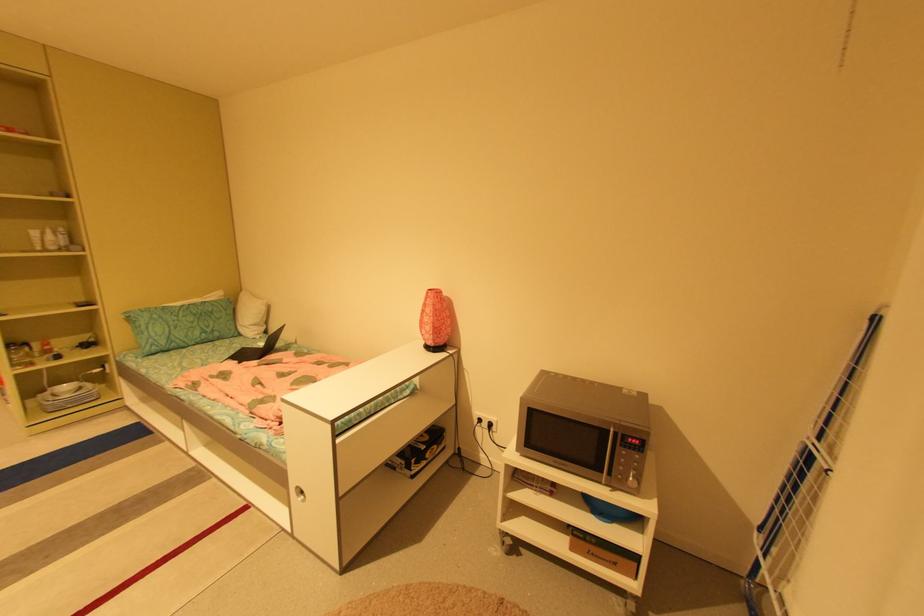
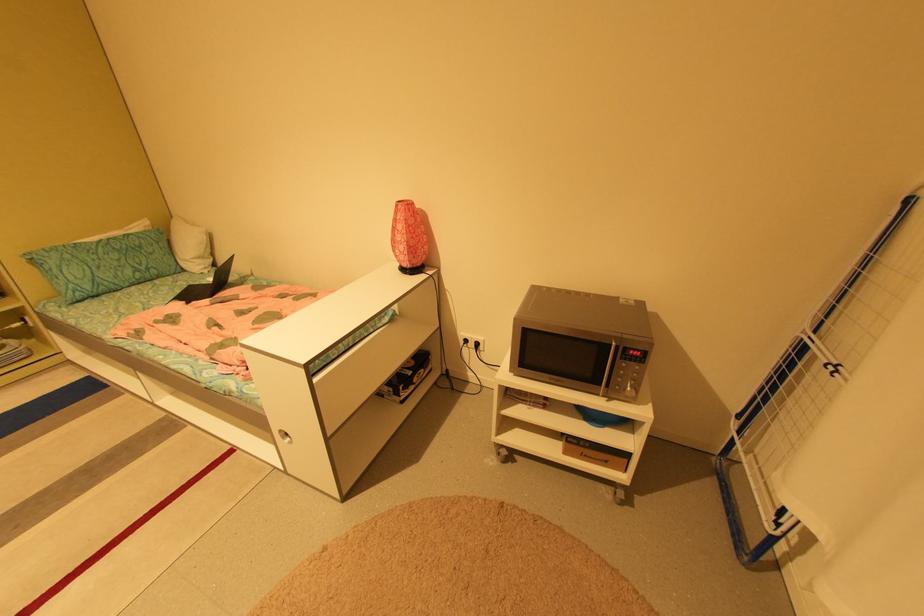
Where in the second image is the point corresponding to (636,484) from the first image?

(633, 394)